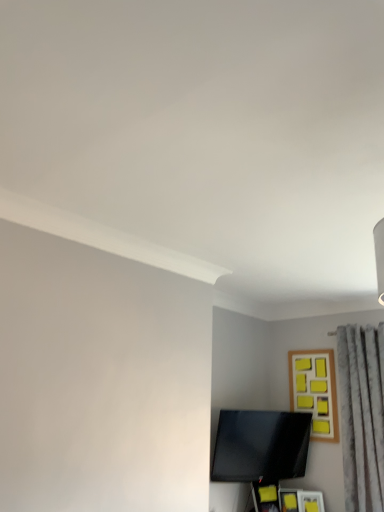
Question: Is wooden frame with yellow sticky notes at upper right to the left of black glossy tv at lower center from the viewer's perspective?

Choices:
 (A) yes
 (B) no

Answer: (B)

Question: Could you tell me if wooden frame with yellow sticky notes at upper right is turned towards black glossy tv at lower center?

Choices:
 (A) yes
 (B) no

Answer: (A)

Question: From a real-world perspective, is wooden frame with yellow sticky notes at upper right on black glossy tv at lower center?

Choices:
 (A) yes
 (B) no

Answer: (A)

Question: Are wooden frame with yellow sticky notes at upper right and black glossy tv at lower center making contact?

Choices:
 (A) yes
 (B) no

Answer: (B)

Question: From the image's perspective, is wooden frame with yellow sticky notes at upper right on top of black glossy tv at lower center?

Choices:
 (A) no
 (B) yes

Answer: (B)

Question: Can you confirm if wooden frame with yellow sticky notes at upper right is thinner than black glossy tv at lower center?

Choices:
 (A) no
 (B) yes

Answer: (B)

Question: Is black glossy tv at lower center positioned behind wooden frame with yellow sticky notes at upper right?

Choices:
 (A) no
 (B) yes

Answer: (A)

Question: Considering the relative sizes of black glossy tv at lower center and wooden frame with yellow sticky notes at upper right in the image provided, is black glossy tv at lower center thinner than wooden frame with yellow sticky notes at upper right?

Choices:
 (A) no
 (B) yes

Answer: (A)

Question: Is black glossy tv at lower center next to wooden frame with yellow sticky notes at upper right and touching it?

Choices:
 (A) yes
 (B) no

Answer: (B)

Question: Is black glossy tv at lower center shorter than wooden frame with yellow sticky notes at upper right?

Choices:
 (A) yes
 (B) no

Answer: (A)

Question: Considering the relative sizes of black glossy tv at lower center and wooden frame with yellow sticky notes at upper right in the image provided, is black glossy tv at lower center smaller than wooden frame with yellow sticky notes at upper right?

Choices:
 (A) yes
 (B) no

Answer: (B)

Question: Considering the relative sizes of black glossy tv at lower center and wooden frame with yellow sticky notes at upper right in the image provided, is black glossy tv at lower center taller than wooden frame with yellow sticky notes at upper right?

Choices:
 (A) yes
 (B) no

Answer: (B)

Question: Is black glossy tv at lower center shorter than gray textured curtain at right?

Choices:
 (A) no
 (B) yes

Answer: (B)